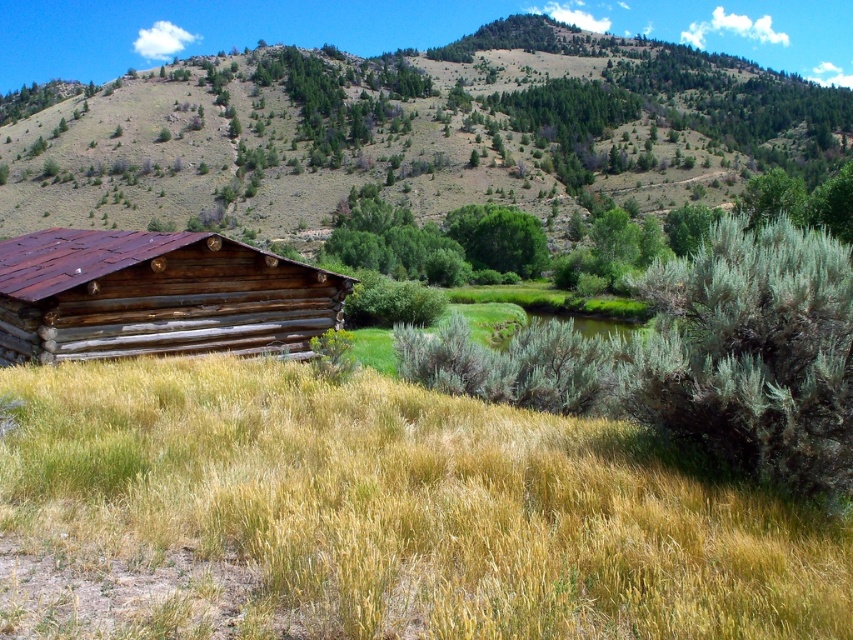
Does dry grass at lower left have a lesser width compared to brown wooden log cabin at left?

Indeed, dry grass at lower left has a lesser width compared to brown wooden log cabin at left.

Based on the photo, does dry grass at lower left lie in front of brown wooden log cabin at left?

Yes, it is in front of brown wooden log cabin at left.

Who is more distant from viewer, (415, 518) or (138, 298)?

Positioned behind is point (138, 298).

This screenshot has height=640, width=853. Find the location of `dry grass at lower left`. dry grass at lower left is located at coordinates (408, 506).

Is dry grass at lower left closer to the viewer compared to green grassy hillside at upper center?

Yes, it is.

This screenshot has width=853, height=640. I want to click on dry grass at lower left, so click(x=408, y=506).

This screenshot has height=640, width=853. In order to click on dry grass at lower left in this screenshot , I will do `click(408, 506)`.

Does green grassy hillside at upper center lie behind brown wooden log cabin at left?

Yes.

Between green grassy hillside at upper center and brown wooden log cabin at left, which one is positioned higher?

green grassy hillside at upper center is higher up.

Which is in front, point (831, 67) or point (207, 236)?

Point (207, 236)

This screenshot has height=640, width=853. What are the coordinates of `green grassy hillside at upper center` in the screenshot? It's located at 431,124.